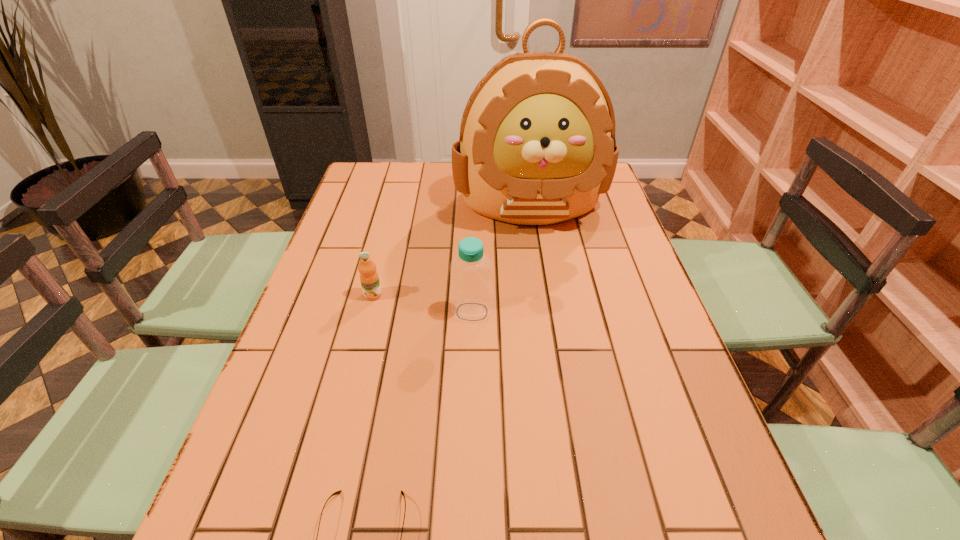
Identify the location of object that is at the far right corner. The width and height of the screenshot is (960, 540). (537, 146).

In the image, there is a desktop. In order to click on vacant space at the far edge in this screenshot , I will do `click(429, 170)`.

At what (x,y) coordinates should I click in order to perform the action: click on free space at the left edge. Please return your answer as a coordinate pair (x, y). Looking at the image, I should click on (276, 521).

Locate an element on the screen. Image resolution: width=960 pixels, height=540 pixels. vacant point located between the third tallest object and the backpack is located at coordinates (451, 249).

Identify the location of vacant space that's between the bottle and the orange juice. Image resolution: width=960 pixels, height=540 pixels. (422, 303).

You are a GUI agent. You are given a task and a screenshot of the screen. Output one action in this format:
    pyautogui.click(x=<x>, y=<y>)
    Task: Click on the free space between the tallest object and the bottle
    
    Given the screenshot: What is the action you would take?
    coord(501,258)

Select which object appears as the third closest to the spectacles. Please provide its 2D coordinates. Your answer should be formatted as a tuple, i.e. [(x, y)], where the tuple contains the x and y coordinates of a point satisfying the conditions above.

[(537, 146)]

I want to click on object identified as the third closest to the orange juice, so coord(337,492).

The width and height of the screenshot is (960, 540). Find the location of `free spot that satisfies the following two spatial constraints: 1. on the label of the orange juice; 2. on the left side of the second tallest object`. free spot that satisfies the following two spatial constraints: 1. on the label of the orange juice; 2. on the left side of the second tallest object is located at coordinates (369, 312).